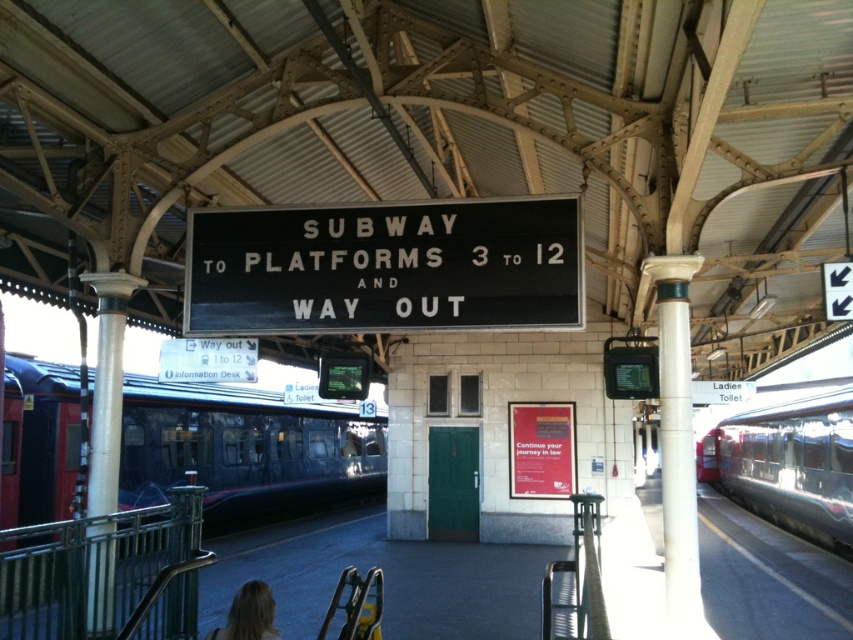
Is dark blue metallic train at left wider than blonde hair at lower left?

Yes.

Which is below, dark blue metallic train at left or blonde hair at lower left?

dark blue metallic train at left is below.

Image resolution: width=853 pixels, height=640 pixels. In order to click on dark blue metallic train at left in this screenshot , I will do `click(242, 449)`.

Which is in front, point (573, 252) or point (814, 420)?

Point (573, 252) is more forward.

Is point (317, 285) in front of point (799, 420)?

Yes, it is in front of point (799, 420).

What are the coordinates of `black matte sign at center` in the screenshot? It's located at (386, 268).

Is point (442, 268) more distant than point (148, 499)?

No, (442, 268) is in front of (148, 499).

Can you confirm if black matte sign at center is taller than dark blue metallic train at left?

No.

Is point (502, 198) closer to viewer compared to point (233, 433)?

Yes.

Where is `black matte sign at center`? The width and height of the screenshot is (853, 640). black matte sign at center is located at coordinates (386, 268).